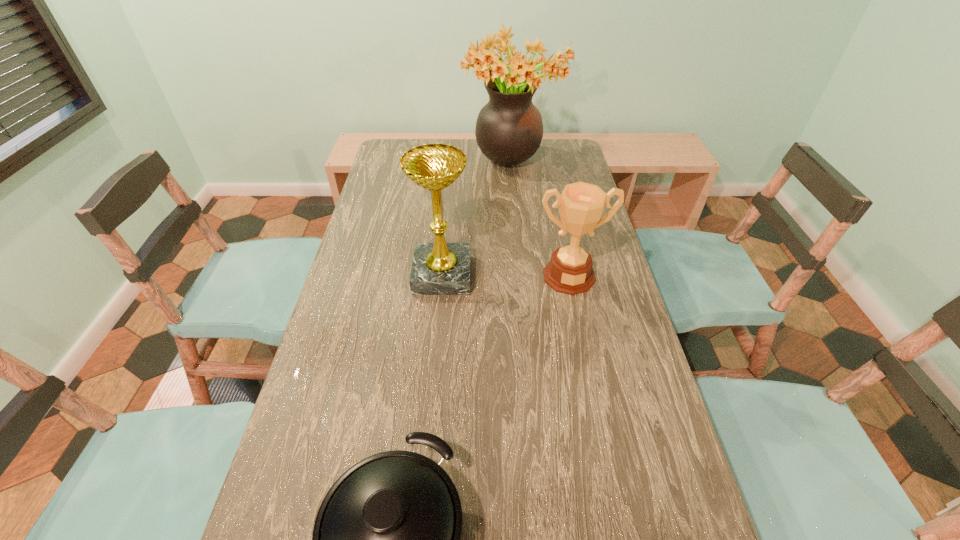
Identify the location of flower arrangement. (509, 129).

The image size is (960, 540). In order to click on the tallest object in this screenshot , I will do `click(509, 129)`.

Image resolution: width=960 pixels, height=540 pixels. Find the location of `the second tallest object`. the second tallest object is located at coordinates (439, 268).

Locate an element on the screen. the taller award is located at coordinates (439, 268).

At what (x,y) coordinates should I click in order to perform the action: click on the right award. Please return your answer as a coordinate pair (x, y). The width and height of the screenshot is (960, 540). Looking at the image, I should click on (581, 205).

Find the location of `the third tallest object`. the third tallest object is located at coordinates (581, 205).

Where is `vacant region located on the front of the tallest object`? vacant region located on the front of the tallest object is located at coordinates (519, 249).

Where is `vacant space located 0.180m on the front-facing side of the third shortest object`? This screenshot has width=960, height=540. vacant space located 0.180m on the front-facing side of the third shortest object is located at coordinates (532, 275).

Identify the location of free location located on the front-facing side of the right award. The width and height of the screenshot is (960, 540). (578, 320).

Identify the location of object that is at the far edge. (509, 129).